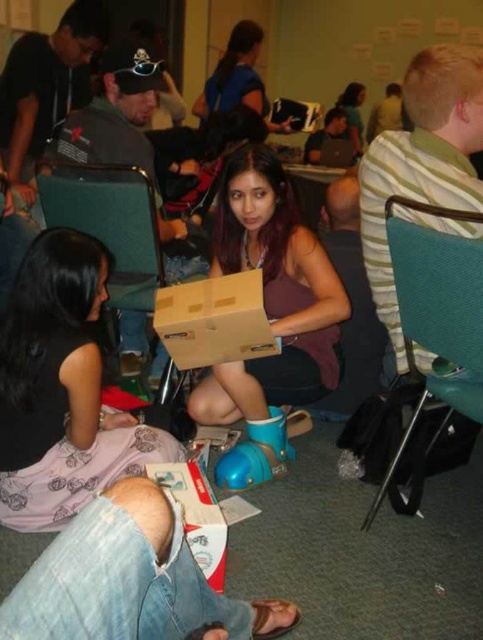
Question: Among these objects, which one is farthest from the camera?

Choices:
 (A) matte cardboard box at center
 (B) brown cardboard box at center
 (C) matte brown hair at upper center
 (D) teal fabric chair at right

Answer: (C)

Question: Which is nearer to the matte pink dress at center?

Choices:
 (A) white cardboard box at lower center
 (B) matte brown hair at upper center
 (C) matte cardboard box at center

Answer: (A)

Question: Can you confirm if matte pink dress at center is positioned to the right of white cardboard box at lower center?

Choices:
 (A) no
 (B) yes

Answer: (A)

Question: Which point is farther to the camera?

Choices:
 (A) matte brown hair at upper center
 (B) matte pink dress at center

Answer: (A)

Question: Does matte pink dress at center appear on the left side of matte cardboard box at center?

Choices:
 (A) no
 (B) yes

Answer: (B)

Question: Can you confirm if matte pink dress at center is smaller than matte cardboard box at center?

Choices:
 (A) yes
 (B) no

Answer: (A)